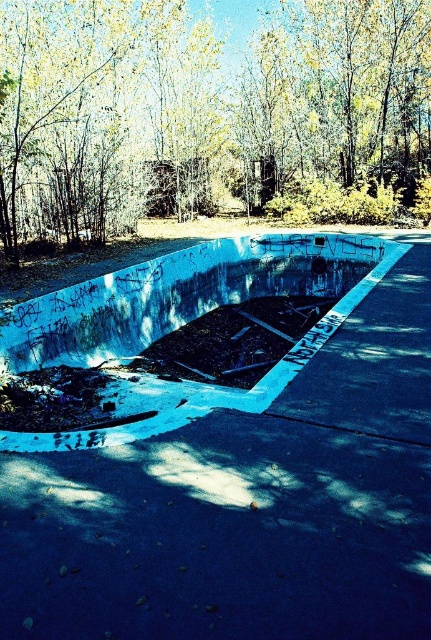
This screenshot has height=640, width=431. In order to click on yellow leafy tree at upper center in this screenshot , I will do `click(202, 100)`.

Can you confirm if yellow leafy tree at upper center is positioned to the right of concrete debris at center?

Incorrect, yellow leafy tree at upper center is not on the right side of concrete debris at center.

This screenshot has height=640, width=431. What are the coordinates of `yellow leafy tree at upper center` in the screenshot? It's located at (202, 100).

Locate an element on the screen. yellow leafy tree at upper center is located at coordinates (202, 100).

Consider the image. How distant is smooth concrete skate park at center from yellow leafy tree at upper center?

smooth concrete skate park at center and yellow leafy tree at upper center are 10.81 meters apart.

Describe the element at coordinates (246, 506) in the screenshot. I see `smooth concrete skate park at center` at that location.

Between point (411, 433) and point (21, 17), which one is positioned in front?

Point (411, 433) is in front.

Locate an element on the screen. The height and width of the screenshot is (640, 431). smooth concrete skate park at center is located at coordinates (246, 506).

Is smooth concrete skate park at center wider than concrete debris at center?

No, smooth concrete skate park at center is not wider than concrete debris at center.

Which is below, smooth concrete skate park at center or concrete debris at center?

smooth concrete skate park at center

In order to click on smooth concrete skate park at center in this screenshot , I will do `click(246, 506)`.

You are a GUI agent. You are given a task and a screenshot of the screen. Output one action in this format:
    pyautogui.click(x=<x>, y=<y>)
    Task: Click on the smooth concrete skate park at center
    This screenshot has width=431, height=640.
    Given the screenshot: What is the action you would take?
    pyautogui.click(x=246, y=506)